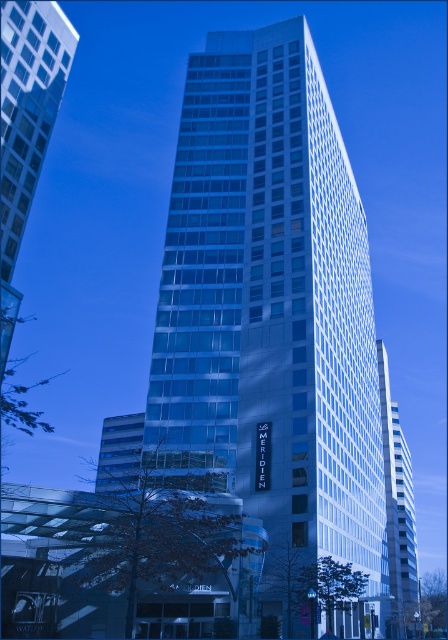
Consider the image. Which of these two, transparent glass building at left or white glass building at center, stands shorter?

transparent glass building at left

Identify the location of transparent glass building at left. This screenshot has width=448, height=640. tap(26, 124).

In order to click on transparent glass building at left in this screenshot , I will do 26,124.

Between glassy white skyscraper at center and transparent glass building at left, which one is positioned lower?

glassy white skyscraper at center is below.

Describe the element at coordinates (271, 316) in the screenshot. The width and height of the screenshot is (448, 640). I see `glassy white skyscraper at center` at that location.

Which is in front, point (331, 323) or point (33, 138)?

Point (331, 323)

At what (x,y) coordinates should I click in order to perform the action: click on glassy white skyscraper at center. Please return your answer as a coordinate pair (x, y). The height and width of the screenshot is (640, 448). Looking at the image, I should click on (271, 316).

Who is more forward, (323, 522) or (404, 586)?

Point (323, 522)

Is glassy white skyscraper at center positioned at the back of white glass building at center?

No, glassy white skyscraper at center is closer to the viewer.

Does point (332, 220) come behind point (405, 500)?

No.

At what (x,y) coordinates should I click in order to perform the action: click on glassy white skyscraper at center. Please return your answer as a coordinate pair (x, y). The image size is (448, 640). Looking at the image, I should click on (271, 316).